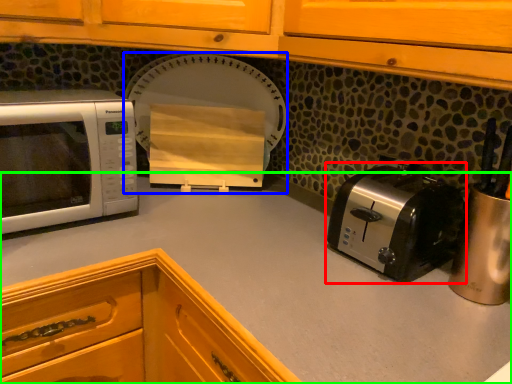
Question: Which object is positioned farthest from toaster (highlighted by a red box)? Select from appliance (highlighted by a blue box) and countertop (highlighted by a green box).

Choices:
 (A) appliance
 (B) countertop

Answer: (A)